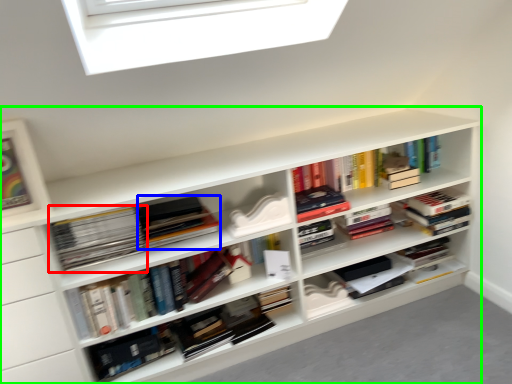
Question: Which object is positioned closest to book (highlighted by a red box)? Select from book (highlighted by a blue box) and shelf (highlighted by a green box).

Choices:
 (A) book
 (B) shelf

Answer: (A)